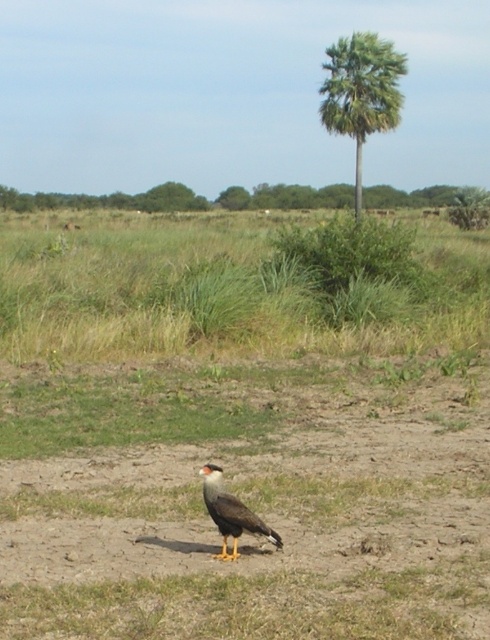
Is point (53, 193) closer to viewer compared to point (242, 509)?

No, it is not.

Can you confirm if green leafy tree at upper center is positioned to the left of brown feathered eagle at center?

Indeed, green leafy tree at upper center is positioned on the left side of brown feathered eagle at center.

Locate an element on the screen. The height and width of the screenshot is (640, 490). green leafy tree at upper center is located at coordinates (188, 198).

Between green leafy palm at upper center and brown feathered eagle at center, which one appears on the right side from the viewer's perspective?

From the viewer's perspective, green leafy palm at upper center appears more on the right side.

Who is more distant from viewer, (390, 84) or (214, 513)?

The point (390, 84) is more distant.

Which is behind, point (347, 84) or point (237, 544)?

The point (347, 84) is more distant.

At what (x,y) coordinates should I click in order to perform the action: click on green leafy palm at upper center. Please return your answer as a coordinate pair (x, y). The height and width of the screenshot is (640, 490). Looking at the image, I should click on (361, 92).

Which of these two, brown dirt field at center or brown feathered eagle at center, stands shorter?

brown feathered eagle at center is shorter.

Between brown dirt field at center and brown feathered eagle at center, which one appears on the right side from the viewer's perspective?

brown feathered eagle at center

What do you see at coordinates (246, 500) in the screenshot? I see `brown dirt field at center` at bounding box center [246, 500].

Where is `brown dirt field at center`? brown dirt field at center is located at coordinates (246, 500).